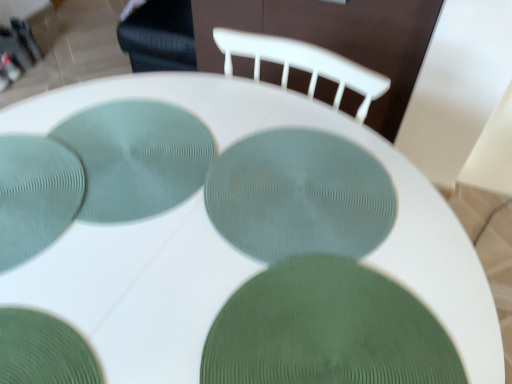
At what (x,y) coordinates should I click in order to perform the action: click on free area in between matte green plate at center, acting as the fourth glass plate starting from the left, and teal textured placemat at center, the third glass plate viewed from the left. Please return your answer as a coordinate pair (x, y). Looking at the image, I should click on (203, 213).